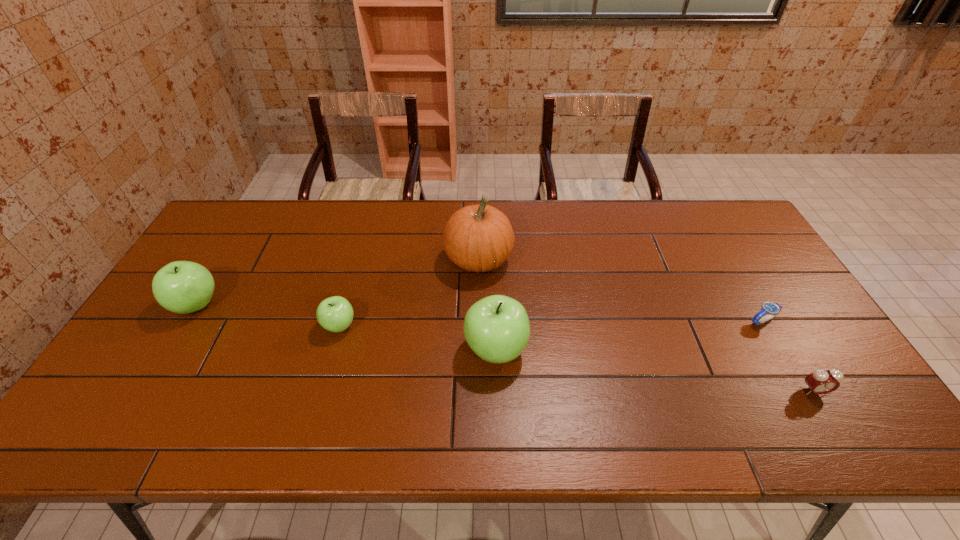
Locate an element on the screen. vacant place for an extra apple on the right is located at coordinates (668, 375).